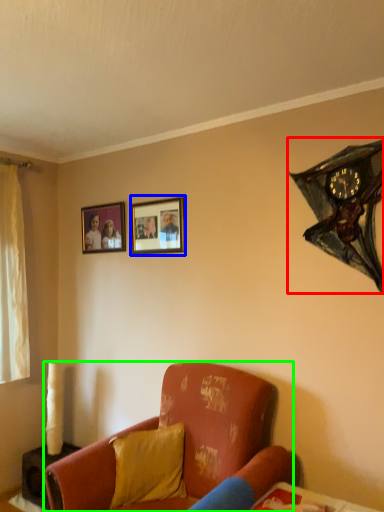
Question: Which object is the closest to the clock (highlighted by a red box)? Choose among these: picture frame (highlighted by a blue box) or studio couch (highlighted by a green box).

Choices:
 (A) picture frame
 (B) studio couch

Answer: (A)